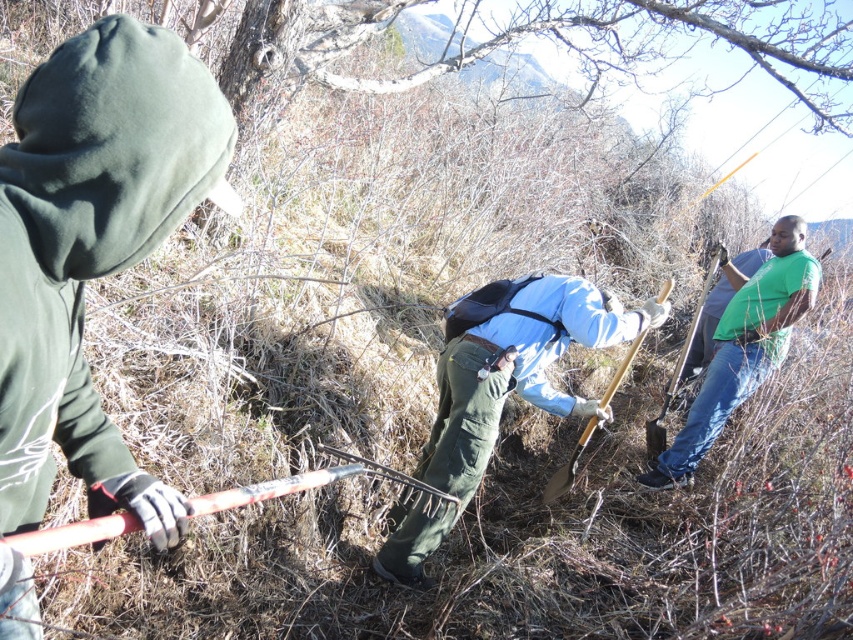
Who is positioned more to the right, blue fabric shovel at center or wooden shovel at right?

Positioned to the right is wooden shovel at right.

Is blue fabric shovel at center to the right of wooden shovel at right from the viewer's perspective?

Incorrect, blue fabric shovel at center is not on the right side of wooden shovel at right.

Describe the element at coordinates (500, 397) in the screenshot. I see `blue fabric shovel at center` at that location.

You are a GUI agent. You are given a task and a screenshot of the screen. Output one action in this format:
    pyautogui.click(x=<x>, y=<y>)
    Task: Click on the blue fabric shovel at center
    This screenshot has width=853, height=640.
    Given the screenshot: What is the action you would take?
    point(500,397)

Between green matte hoodie at left and green matte shirt at right, which one appears on the right side from the viewer's perspective?

From the viewer's perspective, green matte shirt at right appears more on the right side.

Identify the location of green matte hoodie at left. (93, 248).

The height and width of the screenshot is (640, 853). What do you see at coordinates (93, 248) in the screenshot?
I see `green matte hoodie at left` at bounding box center [93, 248].

Is point (42, 237) less distant than point (456, 444)?

Yes, it is in front of point (456, 444).

Identify the location of green matte hoodie at left. The height and width of the screenshot is (640, 853). (93, 248).